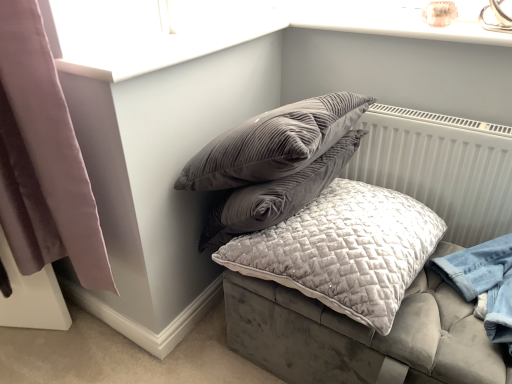
Question: From the image's perspective, relative to velvet grey cushion at center, is velvet quilted pillow at center above or below?

Choices:
 (A) above
 (B) below

Answer: (A)

Question: Do you think velvet quilted pillow at center is within velvet grey cushion at center, or outside of it?

Choices:
 (A) outside
 (B) inside

Answer: (A)

Question: Considering the real-world distances, which object is farthest from the mauve velvet curtain at left?

Choices:
 (A) velvet grey cushion at center
 (B) velvet quilted pillow at center
 (C) white textured radiator at upper right

Answer: (C)

Question: Which of these objects is positioned closest to the mauve velvet curtain at left?

Choices:
 (A) velvet quilted pillow at center
 (B) velvet grey cushion at center
 (C) white textured radiator at upper right

Answer: (A)